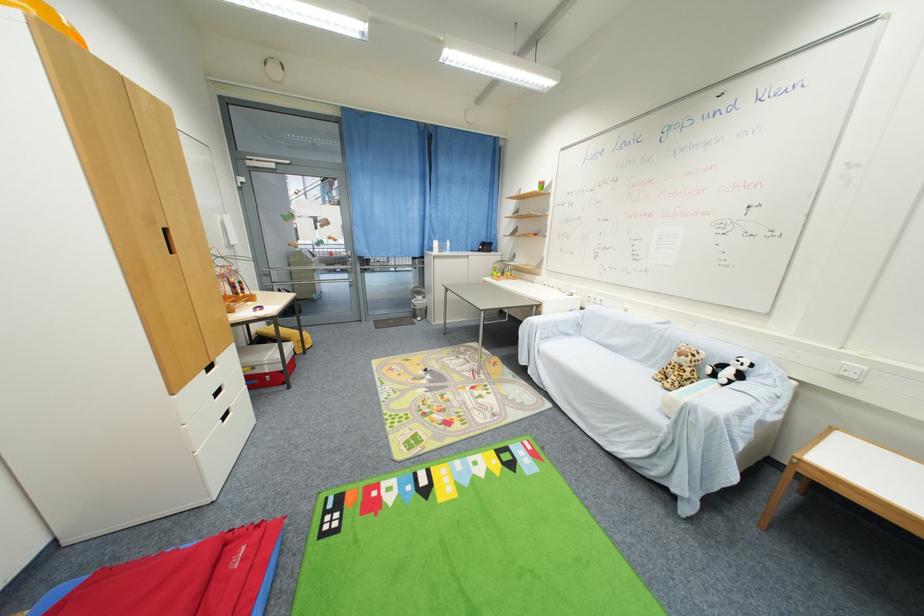
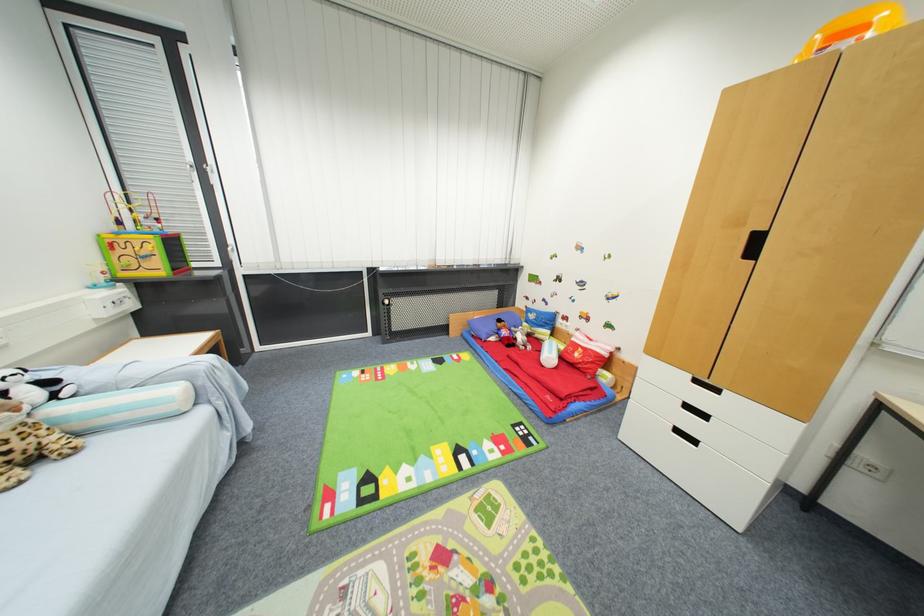
Locate, in the second image, the point that corresponds to [415,488] in the first image.

(479, 455)